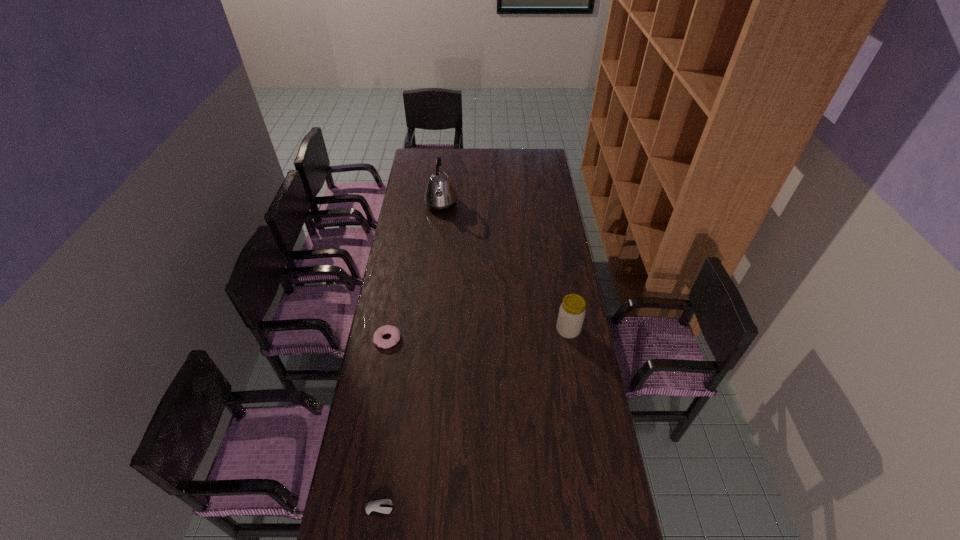
Locate an element on the screen. This screenshot has height=540, width=960. vacant region that satisfies the following two spatial constraints: 1. on the back side of the rightmost object; 2. on the left side of the doughnut is located at coordinates (389, 330).

Image resolution: width=960 pixels, height=540 pixels. I want to click on free space that satisfies the following two spatial constraints: 1. from the spout of the rightmost object; 2. on the left side of the kettle, so click(x=429, y=330).

The width and height of the screenshot is (960, 540). Find the location of `free space that satisfies the following two spatial constraints: 1. from the spout of the tallest object; 2. on the right side of the jar`. free space that satisfies the following two spatial constraints: 1. from the spout of the tallest object; 2. on the right side of the jar is located at coordinates (429, 330).